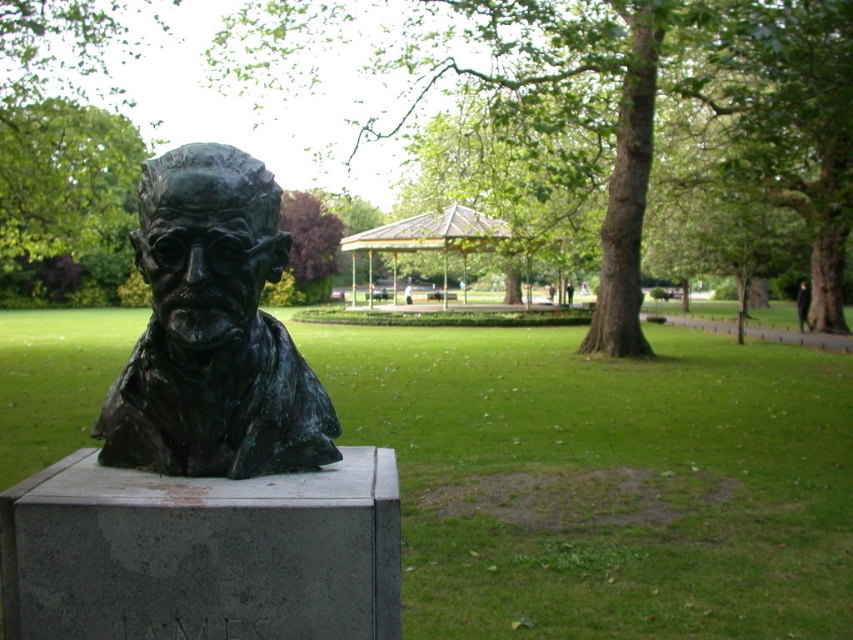
You are standing at the entrance of the park and want to find the green leafy tree at center. According to the coordinates provided, in which direction should you walk from your current position to reach it?

The green leafy tree at center is located at point 0.169 on the x axis and 0.768 on the y axis. Since the coordinates are relative to the image, you should walk towards the lower left direction to reach it.

You are standing at the bronze bust sculpture on the rectangular stone pedestal in the park. You notice two points marked in the scene. The first point is at coordinates point (701, 432) and the second point is at point (218, 410). If you were to walk towards both points from your current position, which point would require you to walk a shorter distance?

The point at (218, 410) is closer to the bronze bust sculpture on the rectangular stone pedestal than the point at (701, 432), so walking towards point (218, 410) would require a shorter distance.

You are a visitor in the park and want to take a photo of the bronze statue at center without the green patina bronze bust at center appearing in the background. Can you position yourself in a way to achieve this?

The green patina bronze bust at center is behind the bronze statue at center, so if you position yourself in front of the bronze statue at center and aim the camera towards it, the green patina bronze bust at center should not be visible in the background.